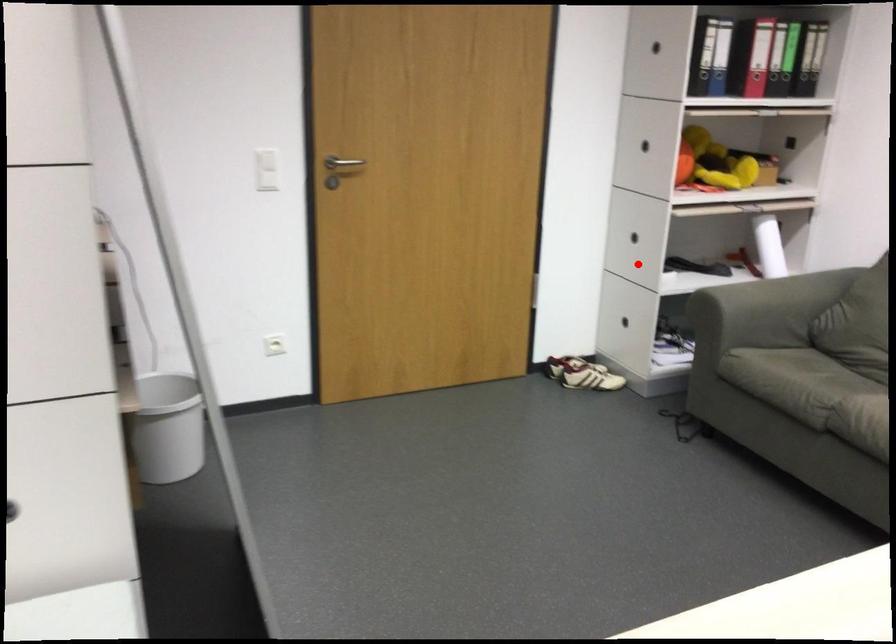
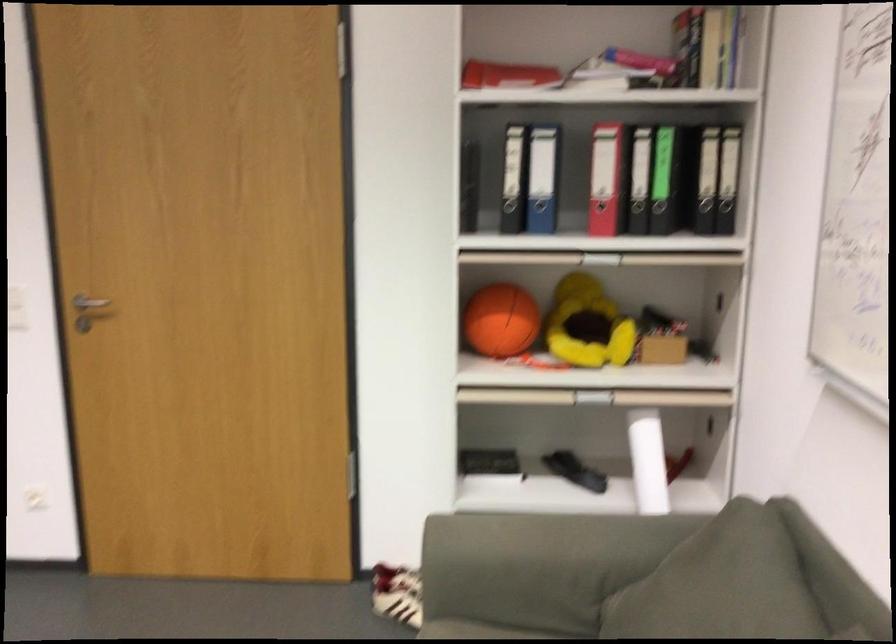
Where in the second image is the point corresponding to the highlighted location from the first image?

(489, 464)